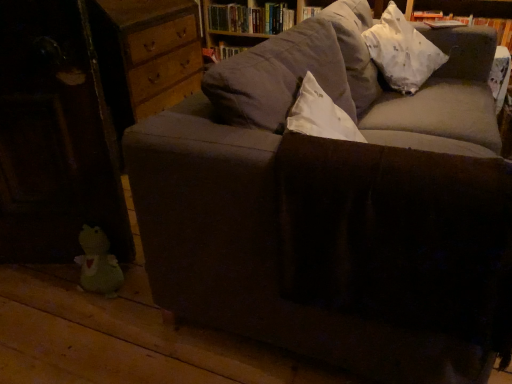
Question: Considering the relative sizes of white fabric pillow at upper right and green plush toy at lower left in the image provided, is white fabric pillow at upper right thinner than green plush toy at lower left?

Choices:
 (A) no
 (B) yes

Answer: (A)

Question: Is white fabric pillow at upper right further to the viewer compared to green plush toy at lower left?

Choices:
 (A) no
 (B) yes

Answer: (B)

Question: Is green plush toy at lower left completely or partially inside white fabric pillow at upper right?

Choices:
 (A) yes
 (B) no

Answer: (B)

Question: From a real-world perspective, is white fabric pillow at upper right located beneath green plush toy at lower left?

Choices:
 (A) no
 (B) yes

Answer: (A)

Question: Is green plush toy at lower left at the back of white fabric pillow at upper right?

Choices:
 (A) yes
 (B) no

Answer: (B)

Question: Choose the correct answer: Is white paper book at upper right, which is counted as the first book, starting from the front, inside hardcover books at upper center, the 1th book in the back-to-front sequence, or outside it?

Choices:
 (A) outside
 (B) inside

Answer: (A)

Question: From the image's perspective, is white paper book at upper right, which is counted as the first book, starting from the front, located above or below hardcover books at upper center, placed as the first book when sorted from left to right?

Choices:
 (A) below
 (B) above

Answer: (A)

Question: Relative to hardcover books at upper center, placed as the first book when sorted from left to right, is white paper book at upper right, which is counted as the first book, starting from the front, in front or behind?

Choices:
 (A) front
 (B) behind

Answer: (A)

Question: In terms of width, does white paper book at upper right, which is the first book from right to left, look wider or thinner when compared to hardcover books at upper center, which is the 2th book from front to back?

Choices:
 (A) wide
 (B) thin

Answer: (B)

Question: Based on their sizes in the image, would you say white paper book at upper right, which is the first book from right to left, is bigger or smaller than green plush toy at lower left?

Choices:
 (A) big
 (B) small

Answer: (A)

Question: Does point (453, 14) appear closer or farther from the camera than point (102, 274)?

Choices:
 (A) closer
 (B) farther

Answer: (B)

Question: From a real-world perspective, is white paper book at upper right, the 2th book positioned from the left, physically located above or below green plush toy at lower left?

Choices:
 (A) below
 (B) above

Answer: (B)

Question: Is white paper book at upper right, marked as the 2th book in a back-to-front arrangement, to the left or to the right of green plush toy at lower left in the image?

Choices:
 (A) left
 (B) right

Answer: (B)

Question: Would you say hardcover books at upper center, placed as the first book when sorted from left to right, is to the left or to the right of white paper book at upper right, the 2th book positioned from the left, in the picture?

Choices:
 (A) right
 (B) left

Answer: (B)

Question: From the image's perspective, is hardcover books at upper center, the 1th book in the back-to-front sequence, positioned above or below white paper book at upper right, the 2th book positioned from the left?

Choices:
 (A) below
 (B) above

Answer: (B)